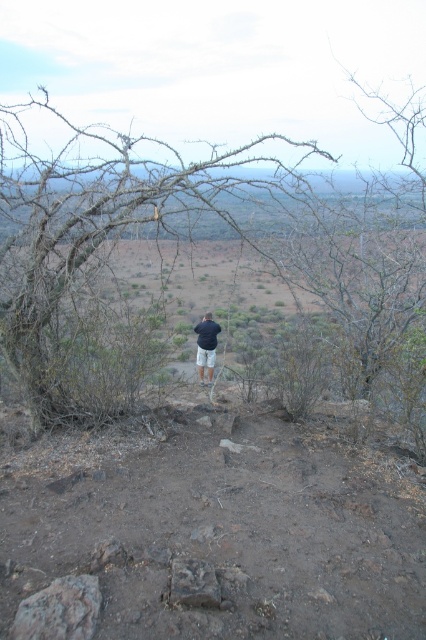
You are standing on the edge of the hill and want to take a photo of the brown dry branches at upper left. Considering the distance, do you think you need a zoom lens to capture them clearly?

The brown dry branches at upper left are 3.90 meters away from the viewer. Since this distance is relatively close, a zoom lens might not be necessary unless you want to magnify the branches further. A standard lens could suffice for capturing them clearly.

You are standing on the hill and want to take a photo of the person at point (106, 394). If your camera has a maximum zoom range of 5 meters, can you clearly capture the person without moving closer?

The point (106, 394) is 4.67 meters away from the viewer. Since the camera can zoom up to 5 meters, you can clearly capture the person without moving closer.

You are standing at the top of the hill in the image and want to avoid stepping on the brown dry branches at upper left located at point (92, 248). Which direction should you move to stay clear of them?

The brown dry branches at upper left are located at point (92, 248). To avoid them, move away from the upper left direction towards the lower right or other areas not indicated by that coordinate.